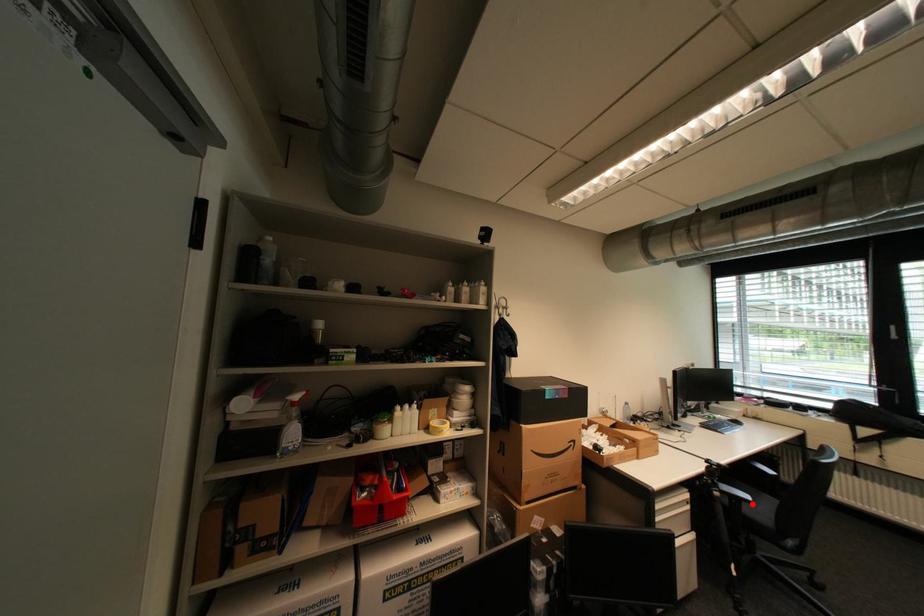
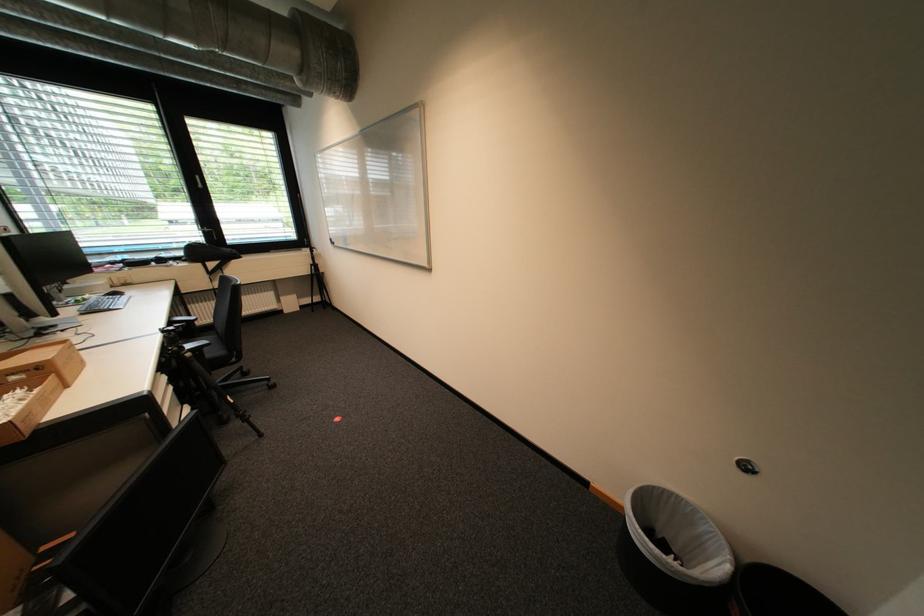
Question: I am providing you with two images of the same scene from different viewpoints. A red point is shown in image1. For the corresponding object point in image2, is it positioned nearer or farther from the camera?

Choices:
 (A) Nearer
 (B) Farther

Answer: (A)